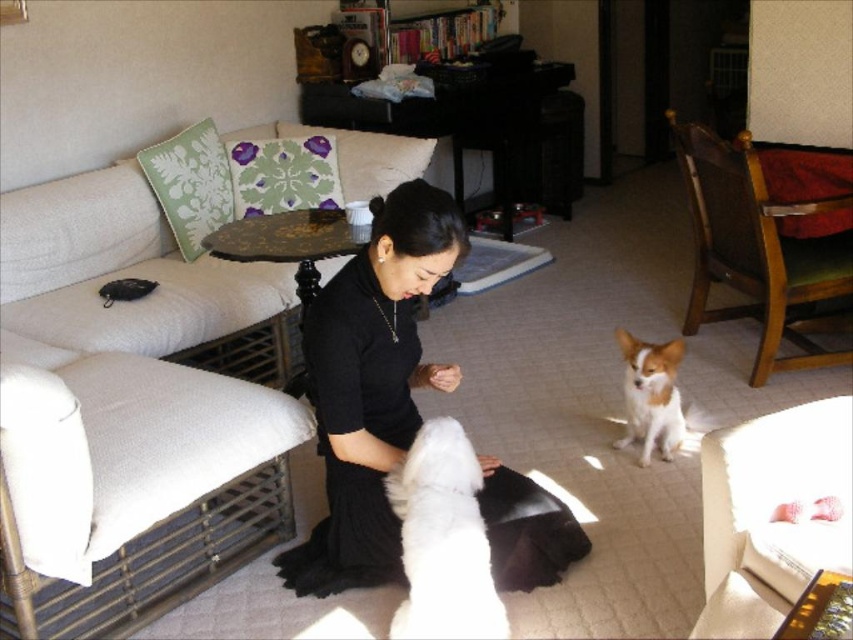
Who is higher up, white fabric couch at left or white fluffy dog at center?

white fabric couch at left is higher up.

Does point (57, 436) come closer to viewer compared to point (474, 500)?

Yes, point (57, 436) is closer to viewer.

Which is behind, point (254, 432) or point (459, 509)?

Point (254, 432)

At what (x,y) coordinates should I click in order to perform the action: click on white fabric couch at left. Please return your answer as a coordinate pair (x, y). The height and width of the screenshot is (640, 853). Looking at the image, I should click on (135, 490).

Does black matte dress at center have a larger size compared to white fluffy dog at center?

Indeed, black matte dress at center has a larger size compared to white fluffy dog at center.

Can you confirm if black matte dress at center is taller than white fluffy dog at center?

Yes, black matte dress at center is taller than white fluffy dog at center.

Is point (361, 438) closer to viewer compared to point (469, 634)?

No, (361, 438) is further to viewer.

Locate an element on the screen. This screenshot has height=640, width=853. black matte dress at center is located at coordinates (370, 385).

Which is more to the left, white fabric couch at lower right or green fabric pillow at upper left?

Positioned to the left is green fabric pillow at upper left.

Is point (801, 445) farther from viewer compared to point (181, 173)?

No, (801, 445) is in front of (181, 173).

The height and width of the screenshot is (640, 853). In order to click on white fabric couch at lower right in this screenshot , I will do `click(770, 515)`.